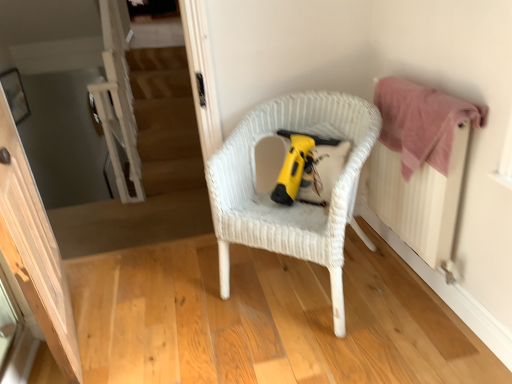
Find the location of `vacant area that lies between white wicker chair at center and transparent glass screen door at left`. vacant area that lies between white wicker chair at center and transparent glass screen door at left is located at coordinates (176, 318).